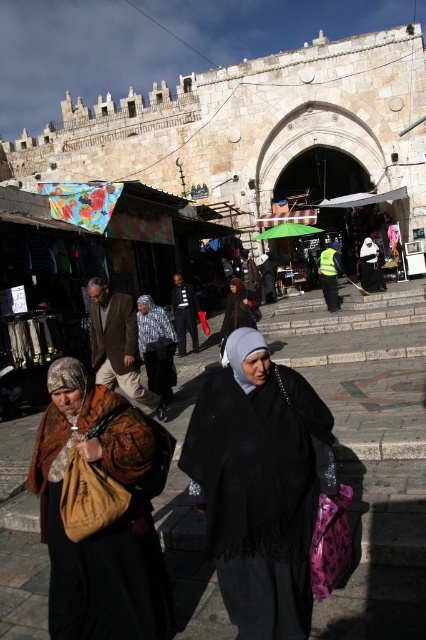
Who is taller, black woolen shawl at center or dark gray knit hat at center?

With more height is black woolen shawl at center.

Who is higher up, black woolen shawl at center or dark gray knit hat at center?

Positioned higher is dark gray knit hat at center.

What are the coordinates of `black woolen shawl at center` in the screenshot? It's located at pyautogui.click(x=259, y=484).

Can you confirm if brown textured fabric bag at lower left is thinner than dark gray knit hat at center?

No.

Is brown textured fabric bag at lower left positioned at the back of dark gray knit hat at center?

No, brown textured fabric bag at lower left is closer to the viewer.

Image resolution: width=426 pixels, height=640 pixels. In order to click on brown textured fabric bag at lower left in this screenshot , I will do `click(100, 509)`.

This screenshot has height=640, width=426. What do you see at coordinates (259, 484) in the screenshot? I see `black woolen shawl at center` at bounding box center [259, 484].

Measure the distance from black woolen shawl at center to brown textured fabric bag at lower left.

black woolen shawl at center is 10.86 feet from brown textured fabric bag at lower left.

The height and width of the screenshot is (640, 426). I want to click on black woolen shawl at center, so [259, 484].